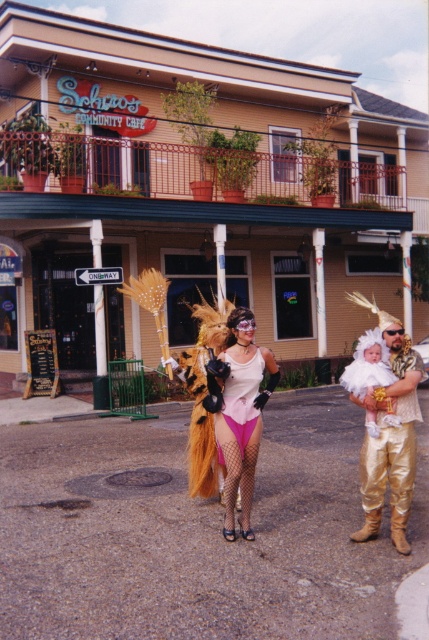
Is shiny gold costume at center closer to the viewer compared to pink satin dress at center?

Yes, it is.

Between point (366, 518) and point (235, 371), which one is positioned in front?

Positioned in front is point (366, 518).

What are the coordinates of `shiny gold costume at center` in the screenshot? It's located at (389, 435).

Is shiny gold costume at center taller than pink fishnet stockings at center?

In fact, shiny gold costume at center may be shorter than pink fishnet stockings at center.

Does shiny gold costume at center appear on the left side of pink fishnet stockings at center?

No, shiny gold costume at center is not to the left of pink fishnet stockings at center.

What are the coordinates of `shiny gold costume at center` in the screenshot? It's located at (389, 435).

Locate an element on the screen. shiny gold costume at center is located at coordinates (389, 435).

Is pink fishnet stockings at center smaller than pink satin dress at center?

No, pink fishnet stockings at center is not smaller than pink satin dress at center.

Who is positioned more to the right, pink fishnet stockings at center or pink satin dress at center?

From the viewer's perspective, pink satin dress at center appears more on the right side.

Does point (224, 525) lie in front of point (256, 369)?

Yes.

The image size is (429, 640). I want to click on pink fishnet stockings at center, so click(x=238, y=412).